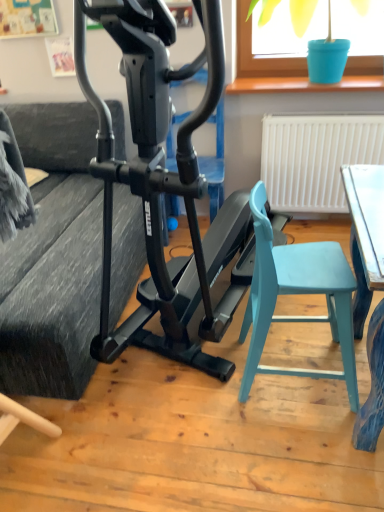
Question: Relative to black matte stationary bicycle at center, is light blue plastic chair at lower right in front or behind?

Choices:
 (A) behind
 (B) front

Answer: (A)

Question: From a real-world perspective, is light blue plastic chair at lower right physically located above or below black matte stationary bicycle at center?

Choices:
 (A) above
 (B) below

Answer: (B)

Question: Which is farther from the textured gray couch at left?

Choices:
 (A) light blue plastic chair at lower right
 (B) blue plastic bucket at upper right
 (C) black matte stationary bicycle at center

Answer: (B)

Question: Based on their relative distances, which object is nearer to the textured gray couch at left?

Choices:
 (A) light blue plastic chair at lower right
 (B) blue plastic bucket at upper right
 (C) black matte stationary bicycle at center

Answer: (C)